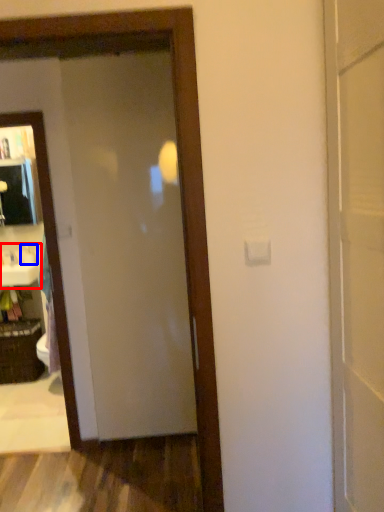
Question: Among these objects, which one is farthest to the camera, sink (highlighted by a red box) or toiletry (highlighted by a blue box)?

Choices:
 (A) sink
 (B) toiletry

Answer: (B)